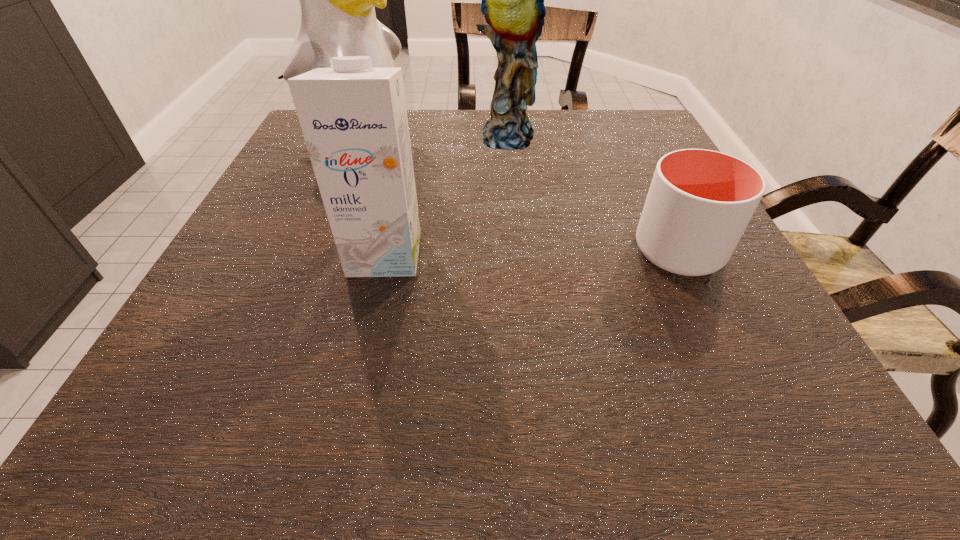
Find the location of a particular element. The image size is (960, 540). vacant position at the left edge of the desktop is located at coordinates (242, 231).

This screenshot has width=960, height=540. Find the location of `vacant area at the right edge of the desktop`. vacant area at the right edge of the desktop is located at coordinates 703,307.

Where is `vacant region at the far left corner`? The width and height of the screenshot is (960, 540). vacant region at the far left corner is located at coordinates click(297, 152).

This screenshot has height=540, width=960. What are the coordinates of `vacant position at the far right corner of the desktop` in the screenshot? It's located at (621, 143).

Locate an element on the screen. The height and width of the screenshot is (540, 960). free spot at the near right corner of the desktop is located at coordinates (697, 359).

I want to click on vacant area that lies between the gull and the rightmost object, so click(x=516, y=198).

This screenshot has height=540, width=960. Find the location of `empty location between the second shortest object and the second object from right to left`. empty location between the second shortest object and the second object from right to left is located at coordinates (445, 195).

Locate an element on the screen. free space between the cup and the second object from right to left is located at coordinates (592, 194).

The height and width of the screenshot is (540, 960). I want to click on vacant area that lies between the parrot and the rightmost object, so click(x=592, y=194).

What are the coordinates of `free space between the gull and the cup` in the screenshot? It's located at (516, 198).